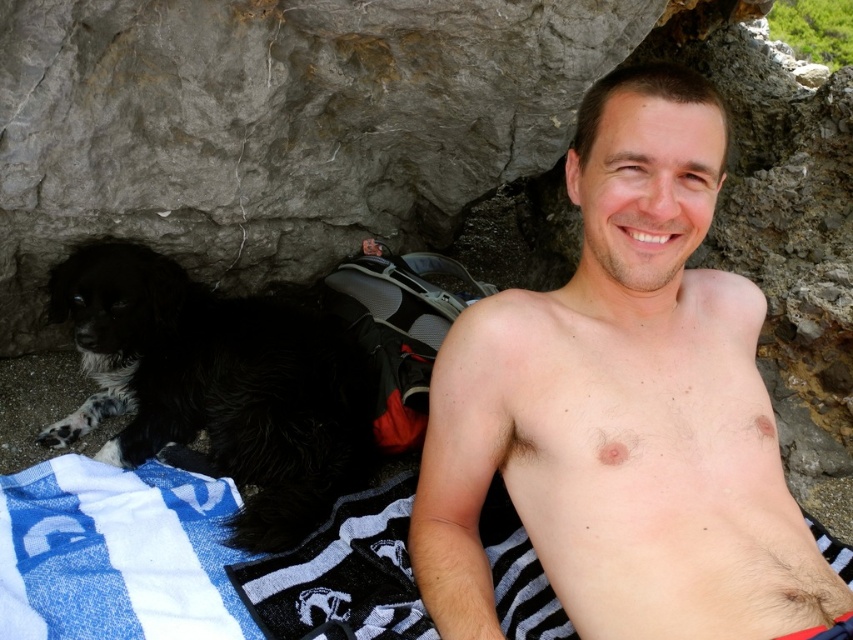
Is hairless skin at center below black fluffy dog at left?

No, hairless skin at center is not below black fluffy dog at left.

Based on the photo, is hairless skin at center thinner than black fluffy dog at left?

Correct, hairless skin at center's width is less than black fluffy dog at left's.

Is point (555, 406) closer to viewer compared to point (165, 349)?

Yes, point (555, 406) is closer to viewer.

I want to click on hairless skin at center, so click(624, 408).